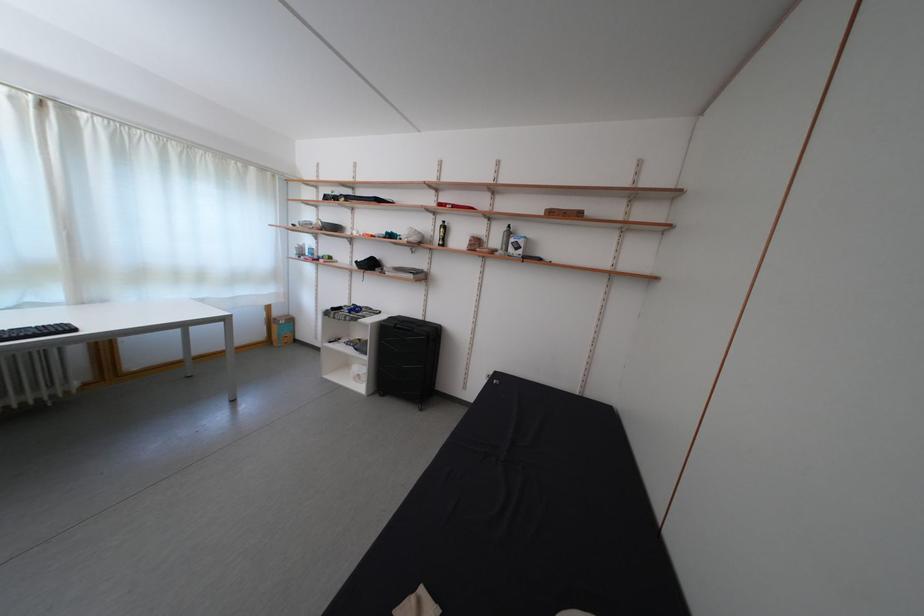
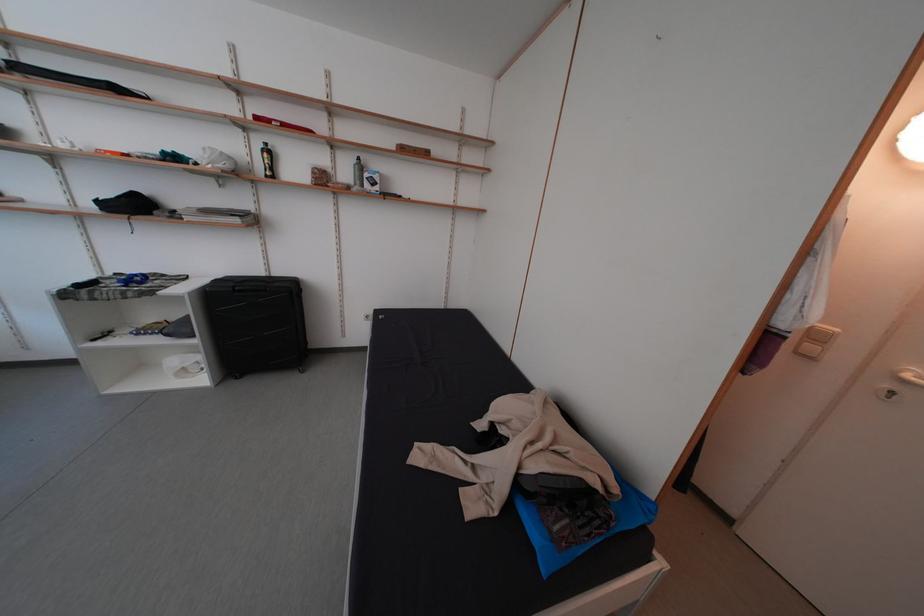
Where in the second image is the point corresponding to point 505,246 from the first image?

(354, 179)